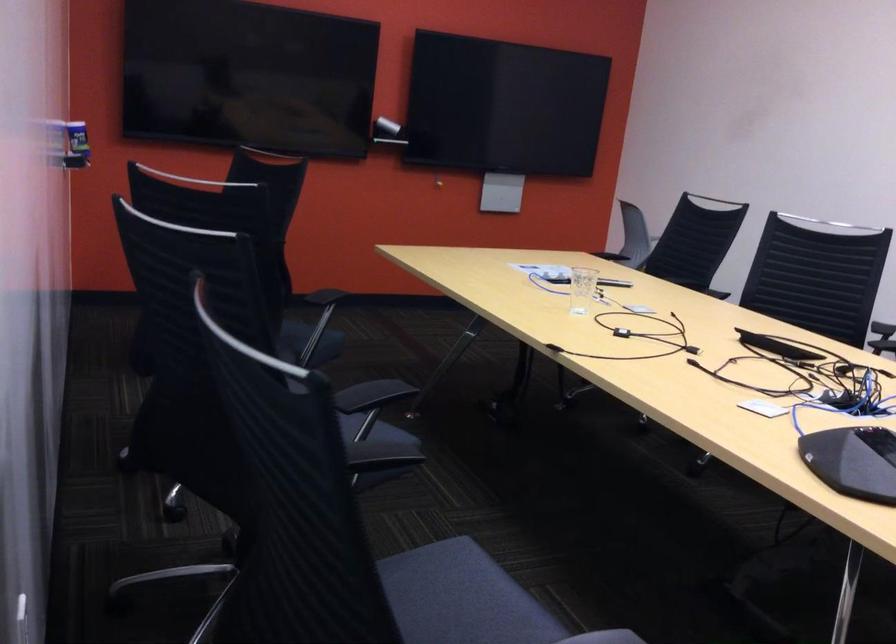
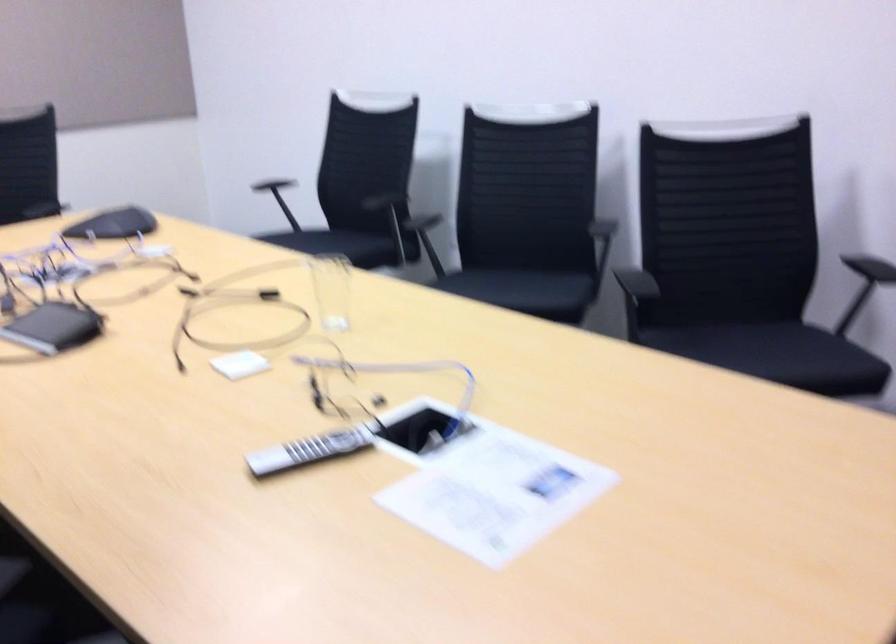
Question: I am providing you with two images of the same scene from different viewpoints. Which of the following objects are not visible in image2?

Choices:
 (A) leopard stuffed toy
 (B) black chair armrest
 (C) chair sitting surface
 (D) grey remote control

Answer: (B)